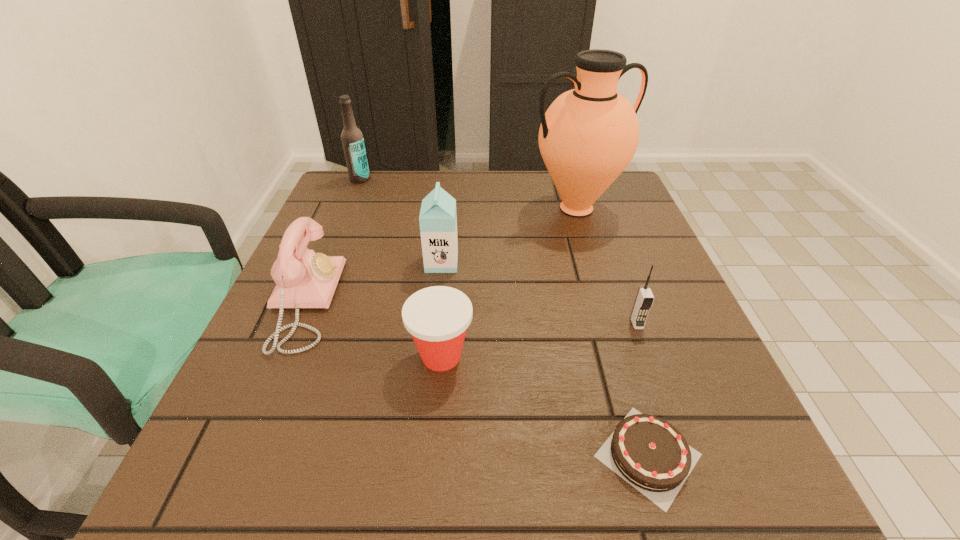
Locate an element on the screen. beer bottle that is positioned at the left edge is located at coordinates (352, 139).

This screenshot has height=540, width=960. In order to click on telephone that is at the left edge in this screenshot , I will do [x=304, y=279].

Identify the location of pitcher located at the right edge. (588, 136).

Locate an element on the screen. cellular telephone positioned at the right edge is located at coordinates [x=644, y=299].

The image size is (960, 540). I want to click on chocolate cake at the right edge, so click(648, 452).

You are a GUI agent. You are given a task and a screenshot of the screen. Output one action in this format:
    pyautogui.click(x=<x>, y=<y>)
    Task: Click on the object present at the far left corner
    Image resolution: width=960 pixels, height=540 pixels.
    Given the screenshot: What is the action you would take?
    pyautogui.click(x=352, y=139)

This screenshot has height=540, width=960. In order to click on object present at the far right corner in this screenshot , I will do tap(588, 136).

This screenshot has height=540, width=960. I want to click on object at the near right corner, so click(648, 452).

In the image, there is a desktop. Identify the location of vacant space at the far edge. The width and height of the screenshot is (960, 540). (516, 185).

Identify the location of vacant space at the near edge. Image resolution: width=960 pixels, height=540 pixels. (300, 512).